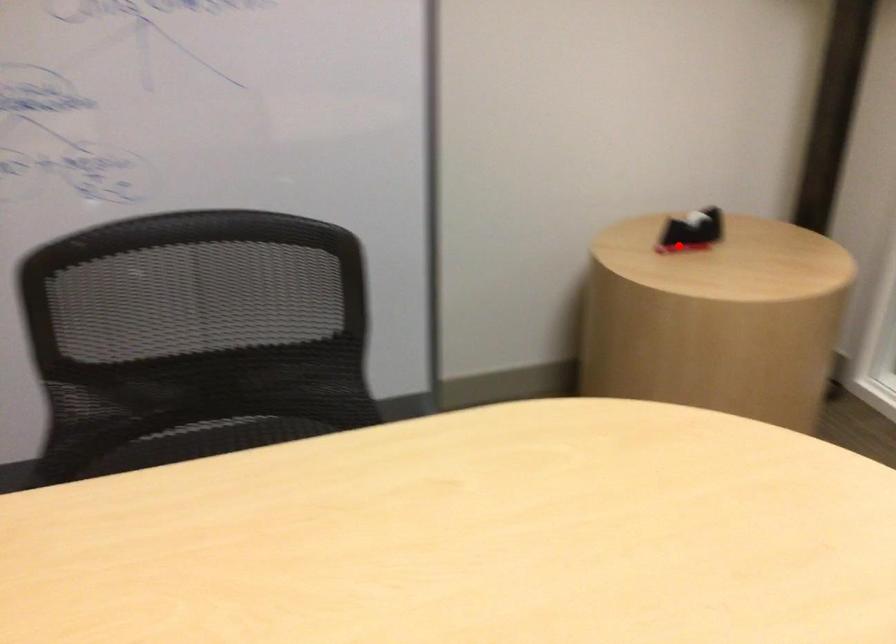
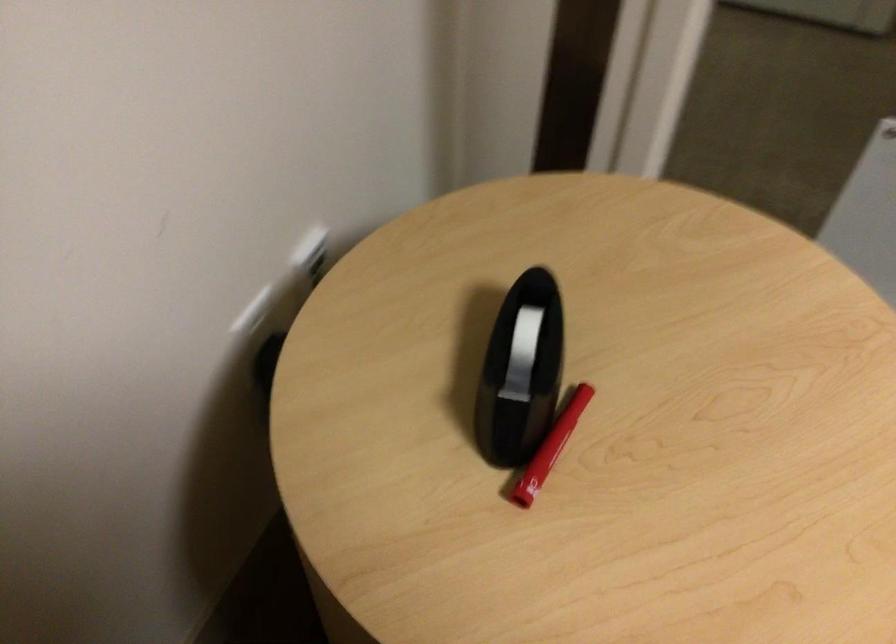
Question: I am providing you with two images of the same scene from different viewpoints. Image1 has a red point marked. In image2, the corresponding 3D location appears at what relative position? Reply with the corresponding letter.

Choices:
 (A) Closer
 (B) Farther

Answer: (A)